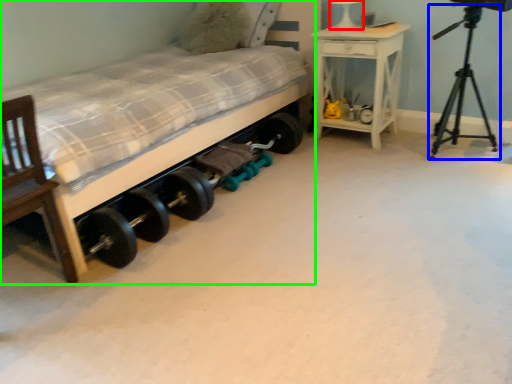
Question: Considering the real-world distances, which object is farthest from table lamp (highlighted by a red box)? tripod (highlighted by a blue box) or bed (highlighted by a green box)?

Choices:
 (A) tripod
 (B) bed

Answer: (B)